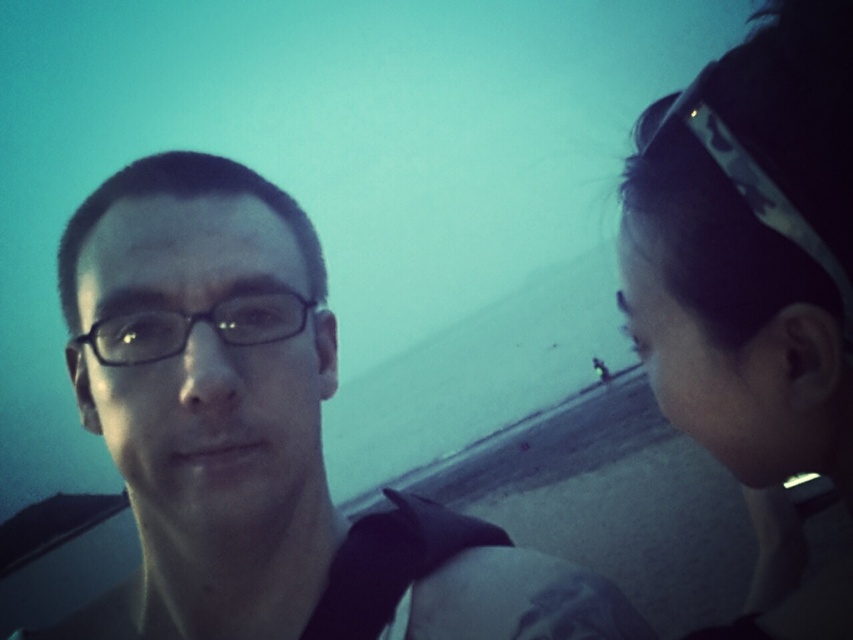
Question: Is matte black glasses at left closer to the viewer compared to camouflage headband at upper right?

Choices:
 (A) no
 (B) yes

Answer: (A)

Question: Which point is closer to the camera?

Choices:
 (A) (167, 324)
 (B) (727, 188)

Answer: (B)

Question: Which of the following is the closest to the observer?

Choices:
 (A) black plastic glasses at left
 (B) camouflage headband at upper right
 (C) matte black glasses at left

Answer: (B)

Question: Can you confirm if matte black glasses at left is positioned below black plastic glasses at left?

Choices:
 (A) yes
 (B) no

Answer: (A)

Question: Based on their relative distances, which object is nearer to the matte black glasses at left?

Choices:
 (A) black plastic glasses at left
 (B) camouflage headband at upper right

Answer: (A)

Question: Can you confirm if camouflage headband at upper right is positioned to the left of black plastic glasses at left?

Choices:
 (A) no
 (B) yes

Answer: (A)